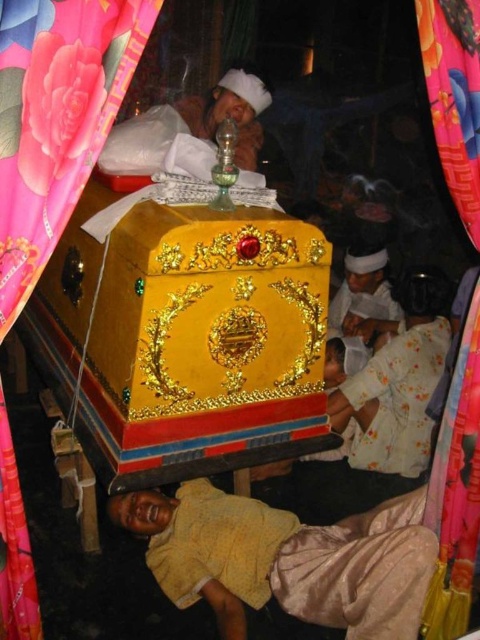
Question: Is yellow fabric at lower center to the right of pink satin curtain at upper left from the viewer's perspective?

Choices:
 (A) yes
 (B) no

Answer: (B)

Question: Which object is closer to the camera taking this photo?

Choices:
 (A) yellow fabric at lower center
 (B) floral cotton robe at lower right

Answer: (A)

Question: Which point is closer to the camera taking this photo?

Choices:
 (A) (409, 580)
 (B) (358, 432)
 (C) (0, 292)

Answer: (C)

Question: Does silky pink fabric at upper left appear over white satin robe at center?

Choices:
 (A) yes
 (B) no

Answer: (B)

Question: Which object is positioned farthest from the pink satin curtain at left?

Choices:
 (A) pink satin curtain at upper left
 (B) white satin robe at center

Answer: (B)

Question: Is yellow fabric at lower center further to the viewer compared to white satin robe at center?

Choices:
 (A) yes
 (B) no

Answer: (B)